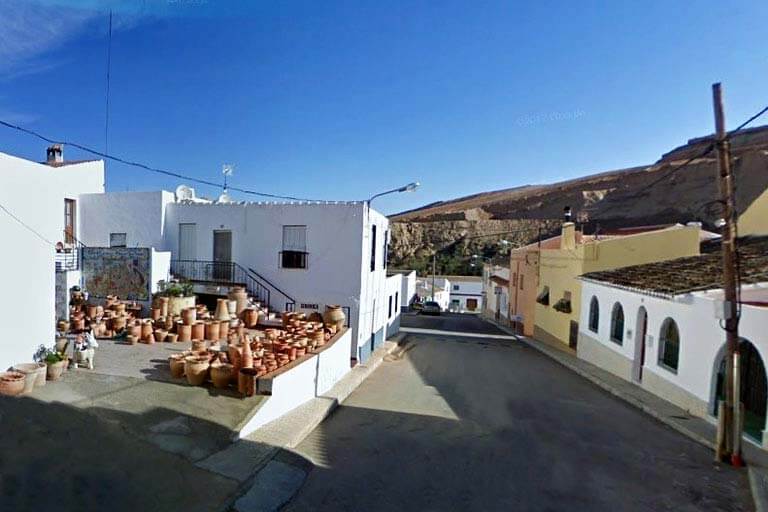
Identify the location of pottery. (104, 313), (137, 326), (196, 336), (224, 356), (250, 364), (270, 360), (267, 347), (283, 335), (329, 327), (313, 322).